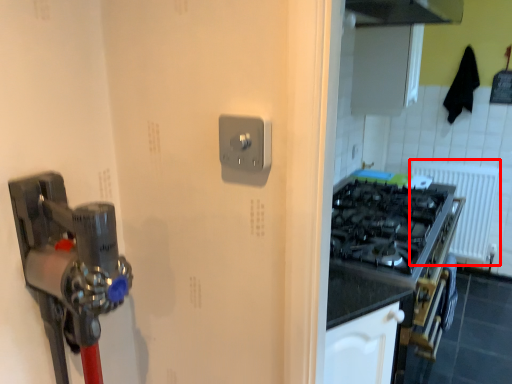
Question: Considering the relative positions of radiator (annotated by the red box) and light switch in the image provided, where is radiator (annotated by the red box) located with respect to the staircase?

Choices:
 (A) right
 (B) left

Answer: (A)